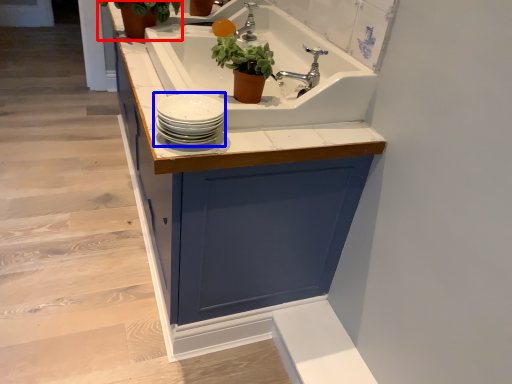
Question: Which object appears farthest to the camera in this image, houseplant (highlighted by a red box) or tableware (highlighted by a blue box)?

Choices:
 (A) houseplant
 (B) tableware

Answer: (A)